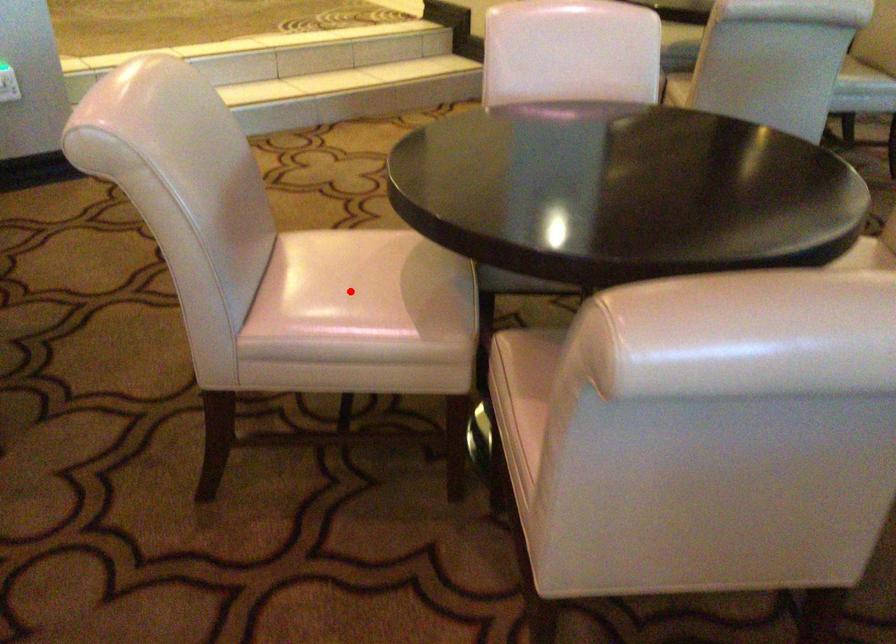
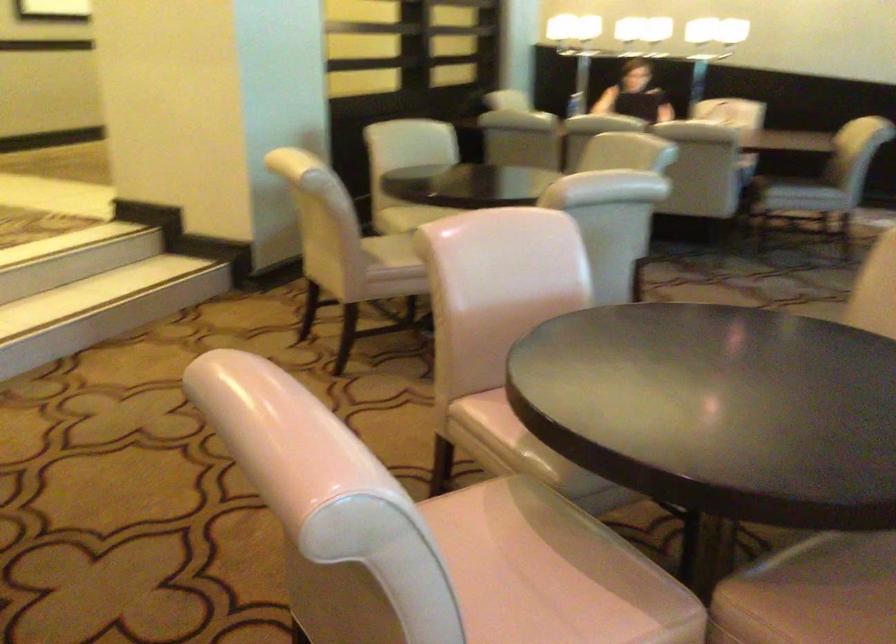
Question: I am providing you with two images of the same scene from different viewpoints. In image1, a red point is highlighted. Considering the same 3D point in image2, which of the following is correct?

Choices:
 (A) It is closer
 (B) It is farther

Answer: (A)